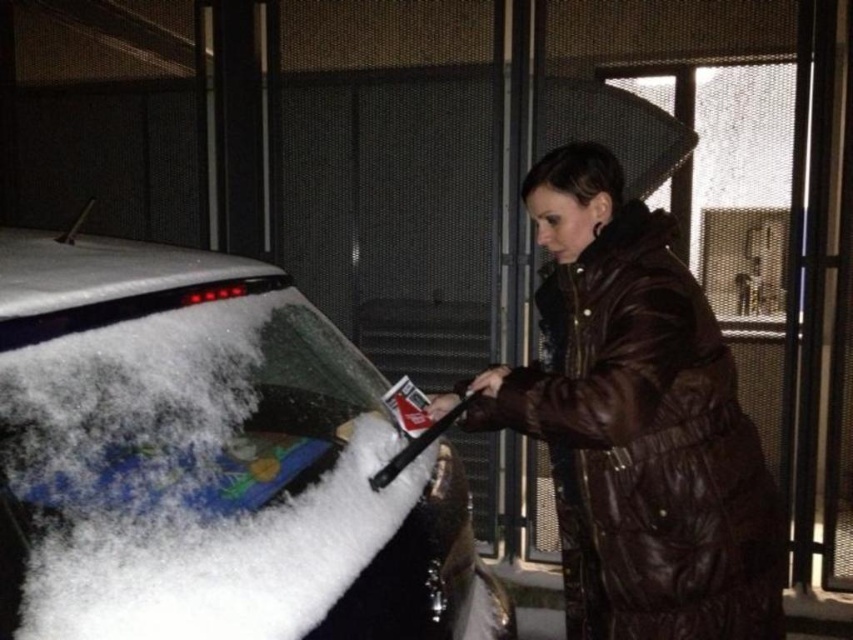
Is snow-covered glass at left bigger than brown leather jacket at center?

Yes.

Is snow-covered glass at left to the left of brown leather jacket at center from the viewer's perspective?

Correct, you'll find snow-covered glass at left to the left of brown leather jacket at center.

Who is more distant from viewer, (74, 481) or (639, 232)?

The point (639, 232) is behind.

Identify the location of snow-covered glass at left. This screenshot has height=640, width=853. coord(210,461).